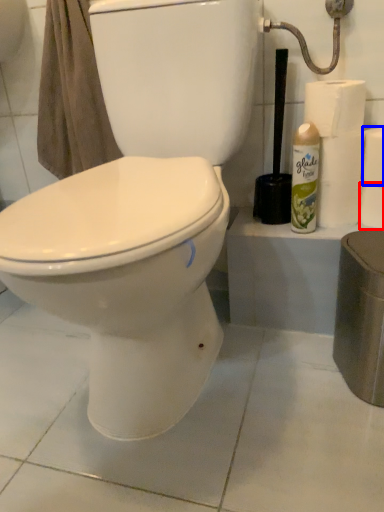
Question: Among these objects, which one is farthest to the camera, toilet paper (highlighted by a red box) or toilet paper (highlighted by a blue box)?

Choices:
 (A) toilet paper
 (B) toilet paper

Answer: (A)